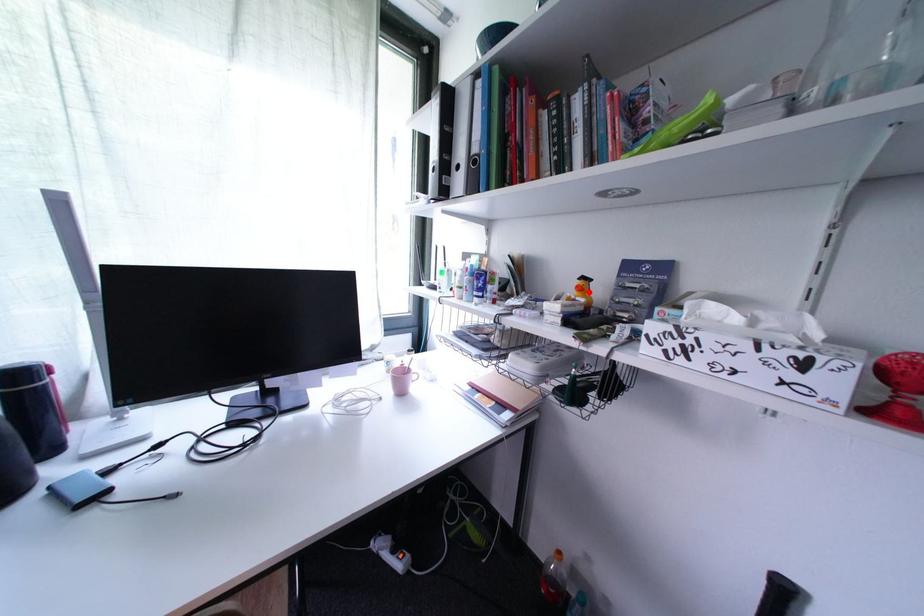
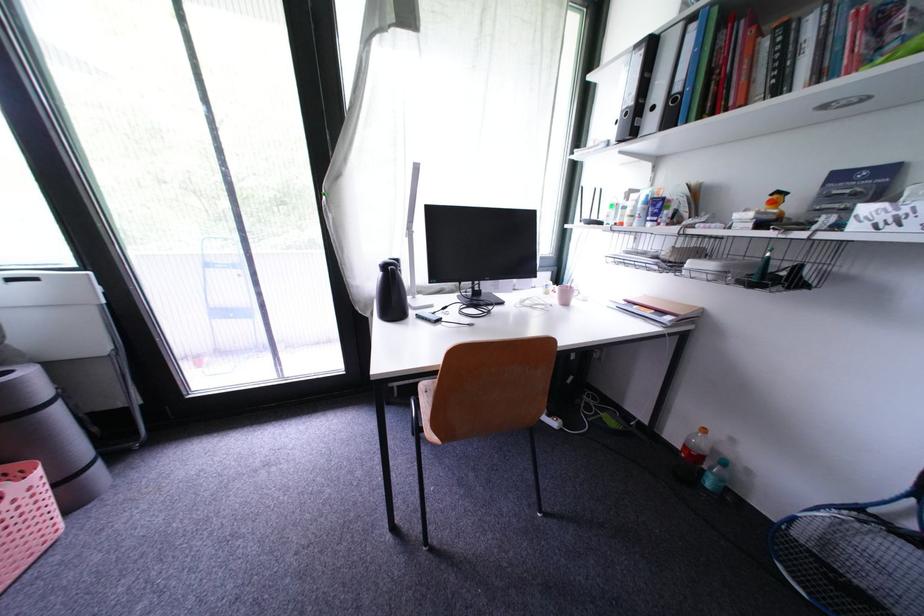
The point at the highlighted location is marked in the first image. Where is the corresponding point in the second image?

(782, 206)